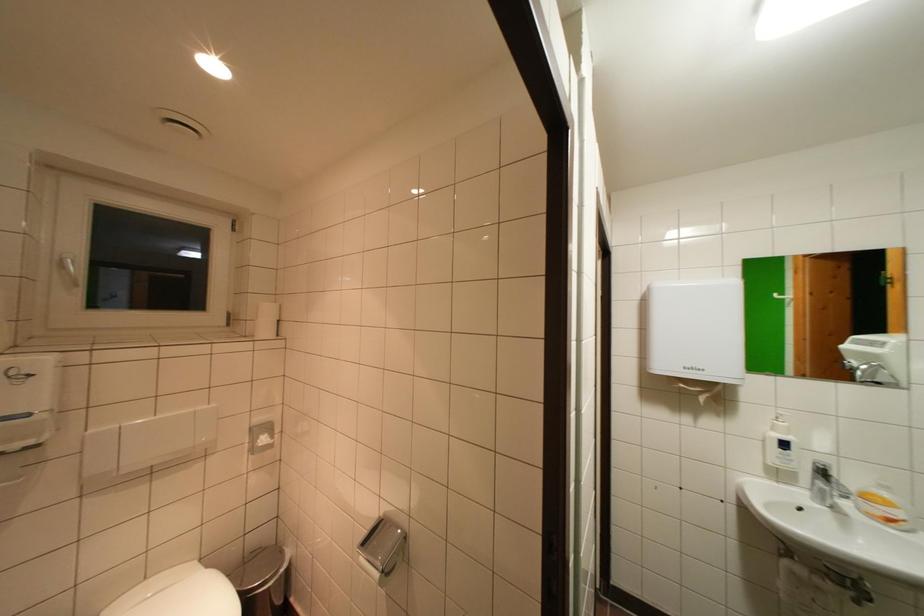
The width and height of the screenshot is (924, 616). Describe the element at coordinates (69, 269) in the screenshot. I see `the white window handle` at that location.